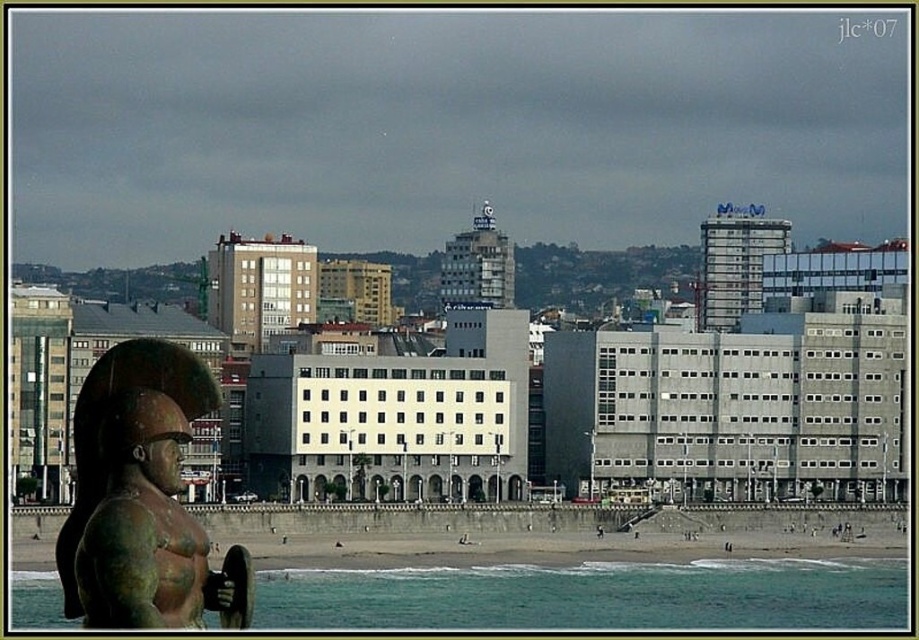
Is greenish-blue water at lower left above bronze statue at left?

Actually, greenish-blue water at lower left is below bronze statue at left.

The height and width of the screenshot is (640, 919). Describe the element at coordinates (591, 595) in the screenshot. I see `greenish-blue water at lower left` at that location.

The width and height of the screenshot is (919, 640). Find the location of `greenish-blue water at lower left`. greenish-blue water at lower left is located at coordinates (591, 595).